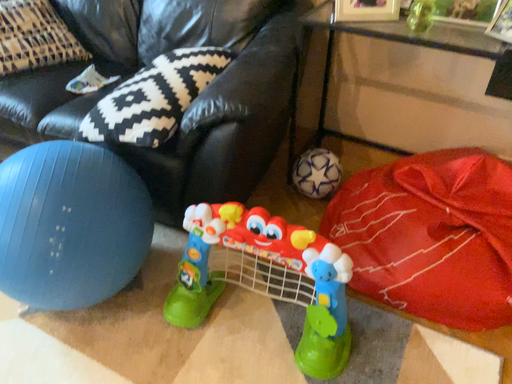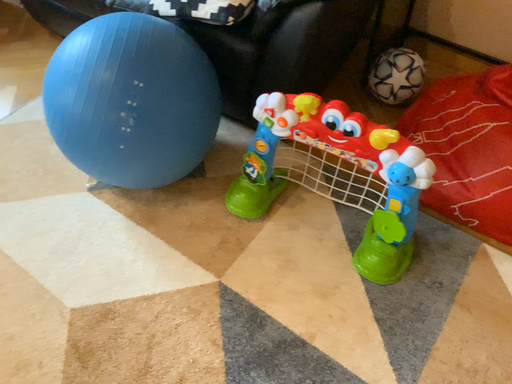
Question: Which way did the camera rotate in the video?

Choices:
 (A) rotated right
 (B) rotated left

Answer: (B)